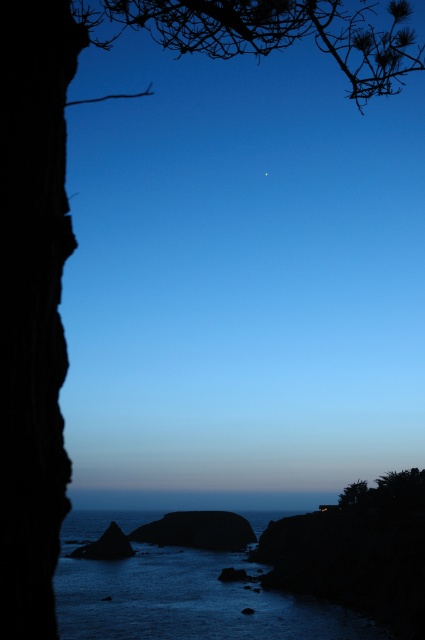
You are standing on the beach looking at the dark rock cliff at left and the smooth dark rock at lower left. Which object is closer to you?

The dark rock cliff at left is closer to you because it is in front of the smooth dark rock at lower left.

You are a photographer trying to capture the reflection of the dark blue water at center and the smooth gray rock at center in the coastal scene. Which object will have a bigger reflection in the photo?

The dark blue water at center has a larger size compared to the smooth gray rock at center, so its reflection will also be bigger in the photo.

You are a photographer trying to capture the reflection of the celestial body in the dark blue water at center. Based on its position, where should you aim your camera?

The dark blue water at center is located at coordinates point (181, 593), so you should aim your camera at that position to capture the reflection.